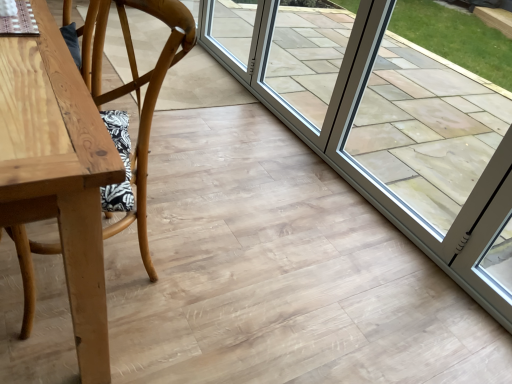
Locate an element on the screen. The height and width of the screenshot is (384, 512). free spot behind wooden chair at left is located at coordinates (184, 187).